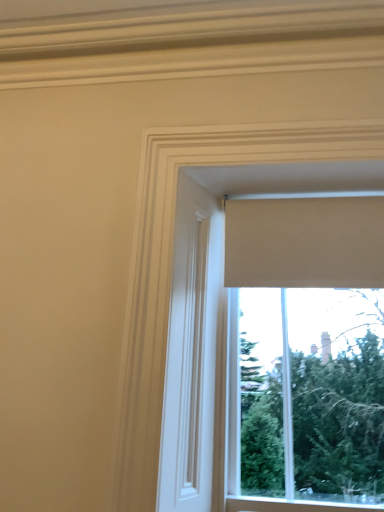
What do you see at coordinates (307, 357) in the screenshot?
I see `beige fabric window at upper center` at bounding box center [307, 357].

Locate an element on the screen. beige fabric window at upper center is located at coordinates (307, 357).

In the scene shown: Measure the distance between beige fabric window at upper center and camera.

beige fabric window at upper center and camera are 1.11 meters apart.

Describe the element at coordinates (305, 242) in the screenshot. I see `beige fabric curtain at upper center` at that location.

This screenshot has height=512, width=384. Find the location of `beige fabric curtain at upper center`. beige fabric curtain at upper center is located at coordinates (305, 242).

At what (x,y) coordinates should I click in order to perform the action: click on beige fabric window at upper center. Please return your answer as a coordinate pair (x, y). Image resolution: width=384 pixels, height=512 pixels. Looking at the image, I should click on (307, 357).

Considering the relative positions of beige fabric curtain at upper center and beige fabric window at upper center in the image provided, is beige fabric curtain at upper center to the right of beige fabric window at upper center from the viewer's perspective?

Correct, you'll find beige fabric curtain at upper center to the right of beige fabric window at upper center.

Based on the photo, is beige fabric curtain at upper center further to camera compared to beige fabric window at upper center?

That is True.

Which is behind, point (308, 234) or point (187, 188)?

Positioned behind is point (308, 234).

From the image's perspective, is beige fabric curtain at upper center beneath beige fabric window at upper center?

No, from the image's perspective, beige fabric curtain at upper center is not beneath beige fabric window at upper center.

From a real-world perspective, between beige fabric curtain at upper center and beige fabric window at upper center, who is vertically lower?

beige fabric window at upper center is physically lower.

Is beige fabric curtain at upper center wider or thinner than beige fabric window at upper center?

In the image, beige fabric curtain at upper center appears to be more narrow than beige fabric window at upper center.

Which of these two, beige fabric curtain at upper center or beige fabric window at upper center, stands shorter?

Standing shorter between the two is beige fabric curtain at upper center.

Is beige fabric curtain at upper center bigger than beige fabric window at upper center?

Actually, beige fabric curtain at upper center might be smaller than beige fabric window at upper center.

Choose the correct answer: Is beige fabric curtain at upper center inside beige fabric window at upper center or outside it?

beige fabric curtain at upper center exists outside the volume of beige fabric window at upper center.

Would you say beige fabric curtain at upper center is a long distance from beige fabric window at upper center?

They are positioned close to each other.

Could you tell me if beige fabric curtain at upper center is facing beige fabric window at upper center?

Yes, beige fabric curtain at upper center faces towards beige fabric window at upper center.

How different are the orientations of beige fabric curtain at upper center and beige fabric window at upper center in degrees?

The facing directions of beige fabric curtain at upper center and beige fabric window at upper center are 0.00355 degrees apart.

Where is `curtain to the right of beige fabric window at upper center`? Image resolution: width=384 pixels, height=512 pixels. curtain to the right of beige fabric window at upper center is located at coordinates (305, 242).

Is beige fabric window at upper center at the right side of beige fabric curtain at upper center?

Incorrect, beige fabric window at upper center is not on the right side of beige fabric curtain at upper center.

Which object is closer to the camera, beige fabric window at upper center or beige fabric curtain at upper center?

beige fabric window at upper center.

Does point (274, 413) lie behind point (234, 272)?

That is True.

From the image's perspective, is beige fabric window at upper center on beige fabric curtain at upper center?

No, from the image's perspective, beige fabric window at upper center is not on top of beige fabric curtain at upper center.

From a real-world perspective, is beige fabric window at upper center on beige fabric curtain at upper center?

No, from a real-world perspective, beige fabric window at upper center is not over beige fabric curtain at upper center

Is beige fabric window at upper center wider than beige fabric curtain at upper center?

Yes.

From the picture: Considering the sizes of objects beige fabric window at upper center and beige fabric curtain at upper center in the image provided, who is shorter, beige fabric window at upper center or beige fabric curtain at upper center?

Standing shorter between the two is beige fabric curtain at upper center.

Considering the sizes of beige fabric window at upper center and beige fabric curtain at upper center in the image, is beige fabric window at upper center bigger or smaller than beige fabric curtain at upper center?

In the image, beige fabric window at upper center appears to be larger than beige fabric curtain at upper center.

Is beige fabric window at upper center completely or partially outside of beige fabric curtain at upper center?

Absolutely, beige fabric window at upper center is external to beige fabric curtain at upper center.

Is beige fabric window at upper center far from beige fabric curtain at upper center?

beige fabric window at upper center is actually quite close to beige fabric curtain at upper center.

Is beige fabric window at upper center oriented away from beige fabric curtain at upper center?

Yes.

What's the angular difference between beige fabric window at upper center and beige fabric curtain at upper center's facing directions?

The angle between the facing direction of beige fabric window at upper center and the facing direction of beige fabric curtain at upper center is 0.00355 degrees.

Image resolution: width=384 pixels, height=512 pixels. Identify the location of curtain on the right side of beige fabric window at upper center. (305, 242).

Identify the location of curtain located above the beige fabric window at upper center (from the image's perspective). The height and width of the screenshot is (512, 384). (305, 242).

Image resolution: width=384 pixels, height=512 pixels. I want to click on curtain that is above the beige fabric window at upper center (from a real-world perspective), so click(x=305, y=242).